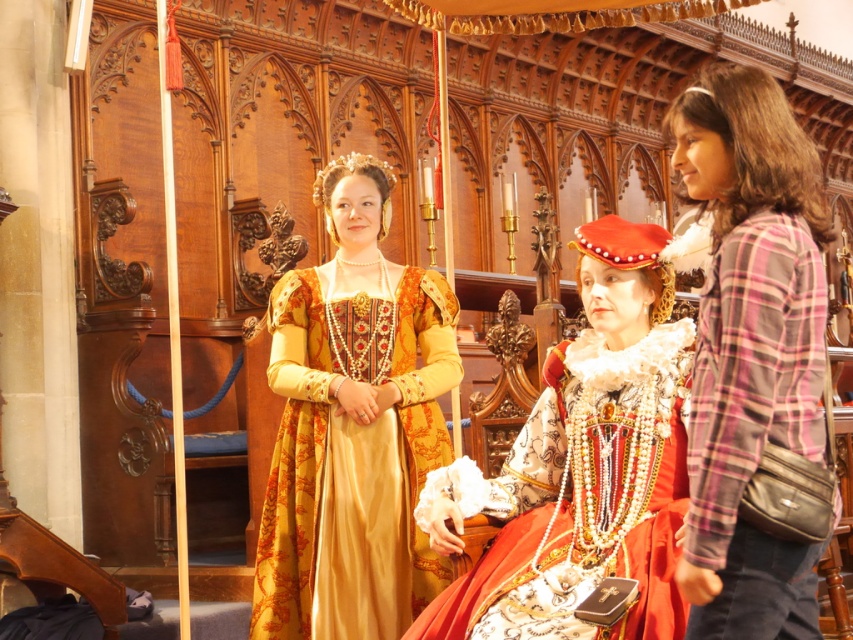
Consider the image. You are an event planner arranging a photoshoot in the historical setting. You need to position the golden silk gown at center and the plaid fabric shirt at right in a way that they are visible in the same frame. Based on their current positions, which one is lower in the image?

The golden silk gown at center is below the plaid fabric shirt at right, so the golden silk gown at center is lower in the image.

You are an interior designer working on a project that requires precise measurements. You need to place a decorative item exactly at the center of the image. However, there is a plaid fabric shirt at right located at coordinates. Will placing the item at the center interfere with the shirt?

The plaid fabric shirt at right is located at point (750, 348), which is not at the center of the image. Placing the decorative item at the center will not interfere with the shirt.

Based on the scene description, where is the golden silk gown at center located in terms of coordinates?

The golden silk gown at center is located at point (352, 426).